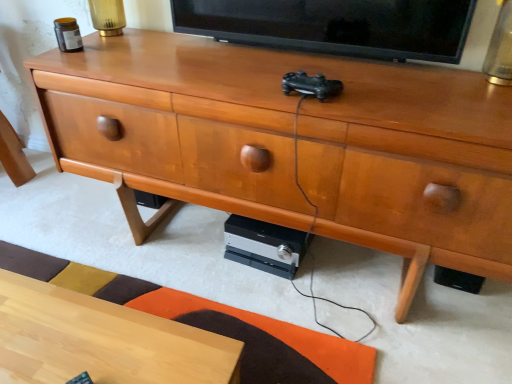
At what (x,y) coordinates should I click in order to perform the action: click on free spot in front of silver/black plastic stereo at lower center. Please return your answer as a coordinate pair (x, y). Looking at the image, I should click on (281, 304).